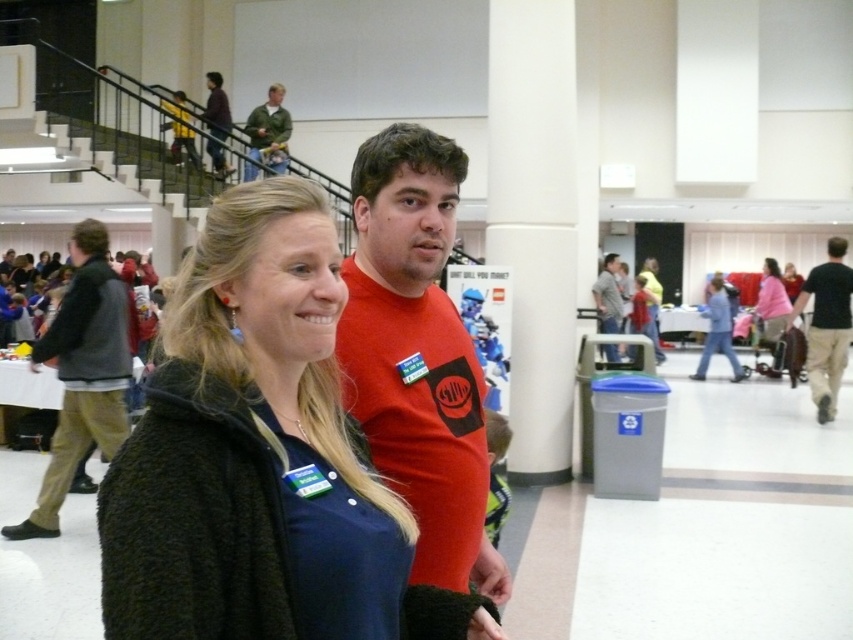
Question: Which point is closer to the camera?

Choices:
 (A) (256, 168)
 (B) (128, 474)

Answer: (B)

Question: Does dark brown woolen coat at center appear over dark gray jacket at left?

Choices:
 (A) yes
 (B) no

Answer: (A)

Question: Which point is closer to the camera?

Choices:
 (A) matte red t-shirt at center
 (B) matte red shirt at center
 (C) dark gray jacket at left

Answer: (A)

Question: Which of the following is the farthest from the observer?

Choices:
 (A) (616, 300)
 (B) (109, 358)
 (C) (770, 349)
 (D) (167, 337)

Answer: (C)

Question: Observing the image, what is the correct spatial positioning of dark brown woolen coat at center in reference to matte red t-shirt at center?

Choices:
 (A) left
 (B) right

Answer: (A)

Question: Can you confirm if green matte jacket at upper center is positioned above dark brown leather jacket at upper left?

Choices:
 (A) yes
 (B) no

Answer: (B)